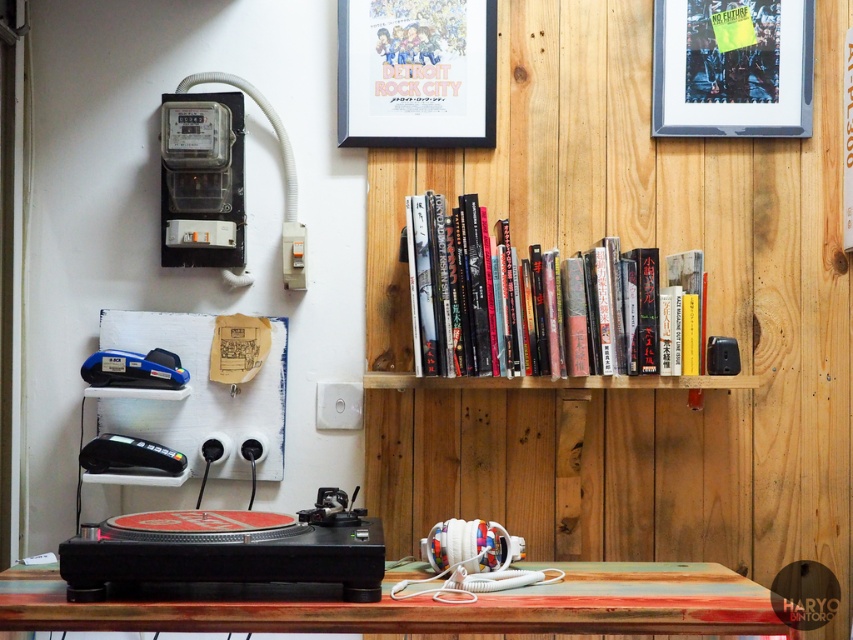
You are a guest in this room and want to place a small gift on the closest object to you. Which object should you choose between the rustic wood table at lower center and the metallic silver picture frame at upper right?

The rustic wood table at lower center is closer to the viewer than the metallic silver picture frame at upper right, so you should place the gift on the rustic wood table at lower center.

You are setting up a new device in the music setup area and need to place it between the metallic silver picture frame at upper right and the black plastic credit card reader at lower left. Based on their positions, which object should you place your new device closer to if you want it to be on the right side of the existing setup?

You should place the new device closer to the metallic silver picture frame at upper right because it is positioned on the right side of the black plastic credit card reader at lower left, making the right side of the setup near the metallic silver picture frame at upper right.

You are setting up a new speaker system and need to place it on the surface closest to the floor. Which object should you choose between the rustic wood table at lower center and the metallic silver picture frame at upper right?

The rustic wood table at lower center is not as tall as the metallic silver picture frame at upper right, so the rustic wood table at lower center is closer to the floor. Therefore, you should place the speaker system on the rustic wood table at lower center.